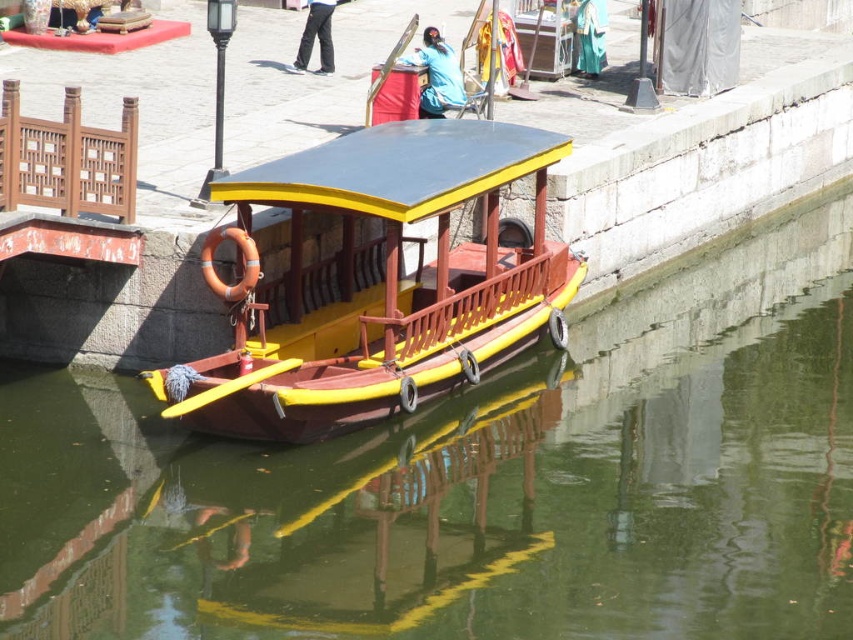
Question: Which point is farther to the camera?

Choices:
 (A) (457, 100)
 (B) (323, 10)
 (C) (576, 42)
 (D) (230, 186)

Answer: (C)

Question: Is wooden polished boat at center wider than dark blue fabric pants at center?

Choices:
 (A) yes
 (B) no

Answer: (A)

Question: Where is smooth green water at center located in relation to teal silk robe at center in the image?

Choices:
 (A) below
 (B) above

Answer: (A)

Question: Which point is closer to the camera taking this photo?

Choices:
 (A) (306, 61)
 (B) (253, 499)
 (C) (234, 324)

Answer: (B)

Question: Among these objects, which one is nearest to the camera?

Choices:
 (A) wooden polished boat at center
 (B) teal silk robe at center
 (C) blue fabric at upper center
 (D) dark blue fabric pants at center

Answer: (A)

Question: In this image, where is smooth green water at center located relative to wooden polished boat at center?

Choices:
 (A) right
 (B) left

Answer: (A)